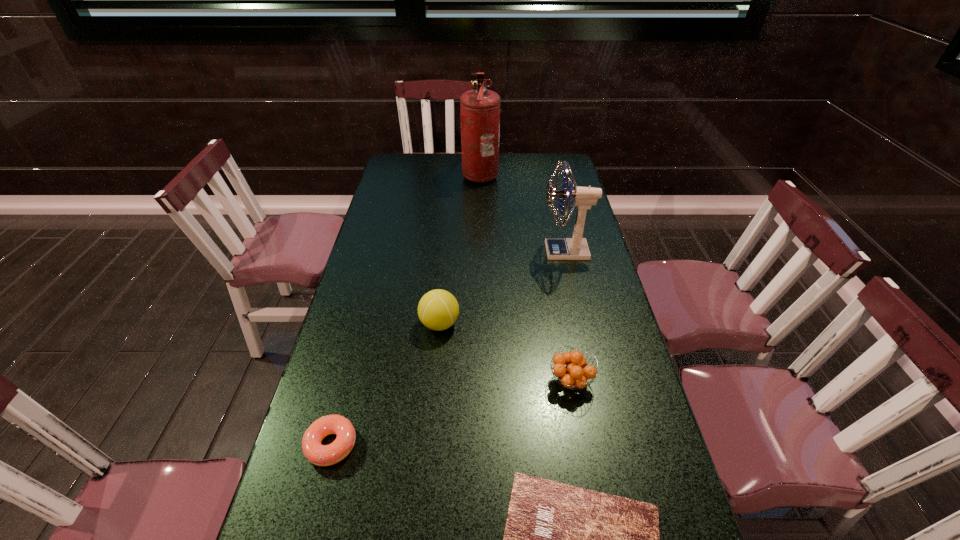
Identify the location of object situated at the left edge. (321, 455).

This screenshot has height=540, width=960. Identify the location of fan present at the right edge. (575, 248).

Locate an element on the screen. This screenshot has width=960, height=540. orange fruit present at the right edge is located at coordinates (575, 374).

Locate an element on the screen. free region at the far edge is located at coordinates (441, 172).

Find the location of a particular element. free point at the left edge is located at coordinates (396, 250).

In the image, there is a desktop. Identify the location of vacant space at the right edge. The height and width of the screenshot is (540, 960). (557, 209).

The image size is (960, 540). I want to click on free space at the far left corner of the desktop, so click(394, 171).

Find the location of a particular element. Image resolution: width=960 pixels, height=540 pixels. vacant area at the far right corner is located at coordinates (553, 163).

At what (x,y) coordinates should I click in order to perform the action: click on free space between the fifth nearest object and the fourth shortest object. Please return your answer as a coordinate pair (x, y). Image resolution: width=960 pixels, height=540 pixels. Looking at the image, I should click on (502, 287).

The width and height of the screenshot is (960, 540). Find the location of `vacant space in between the fifth nearest object and the third shortest object`. vacant space in between the fifth nearest object and the third shortest object is located at coordinates (568, 316).